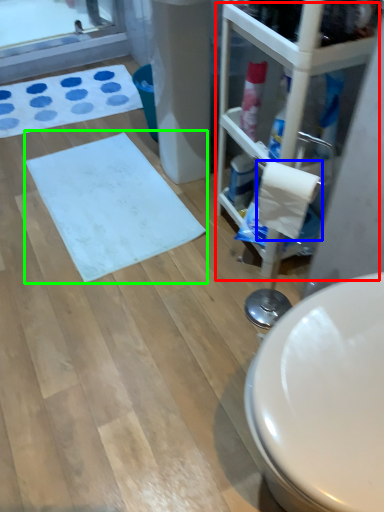
Question: Which object is positioned farthest from glass door (highlighted by a red box)? Select from toilet paper (highlighted by a blue box) and bath mat (highlighted by a green box).

Choices:
 (A) toilet paper
 (B) bath mat

Answer: (B)